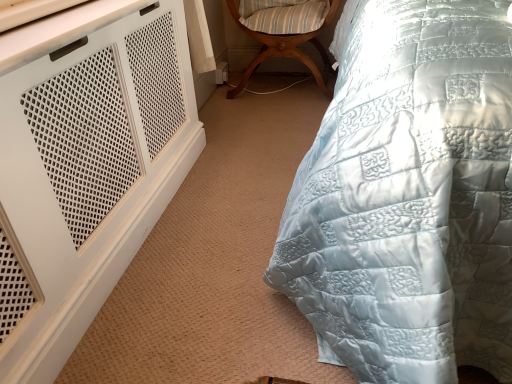
You are a GUI agent. You are given a task and a screenshot of the screen. Output one action in this format:
    pyautogui.click(x=<x>, y=<y>)
    Task: Click on the vacant space underneath wooden striped cushioned chair at center (from a real-world perspective)
    
    Given the screenshot: What is the action you would take?
    pyautogui.click(x=274, y=87)